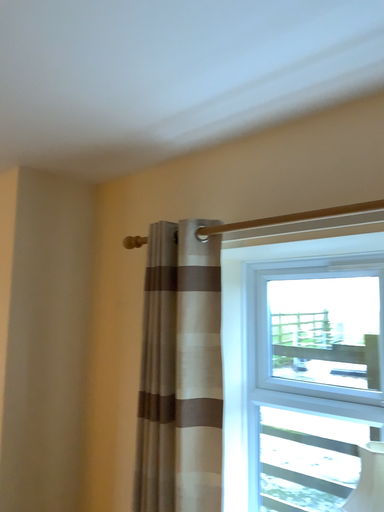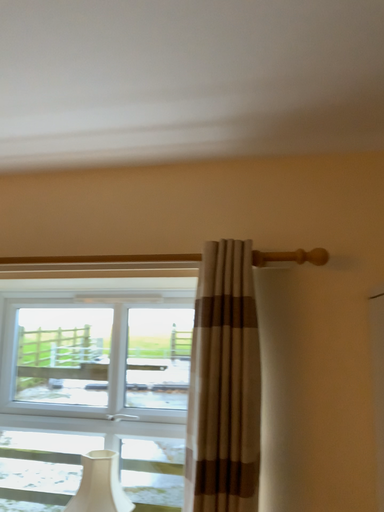
Question: Which way did the camera rotate in the video?

Choices:
 (A) rotated left
 (B) rotated right

Answer: (B)